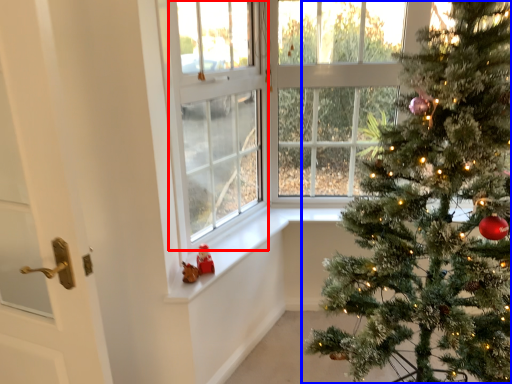
Question: Which of the following is the farthest to the observer, window screen (highlighted by a red box) or christmas tree (highlighted by a blue box)?

Choices:
 (A) window screen
 (B) christmas tree

Answer: (A)